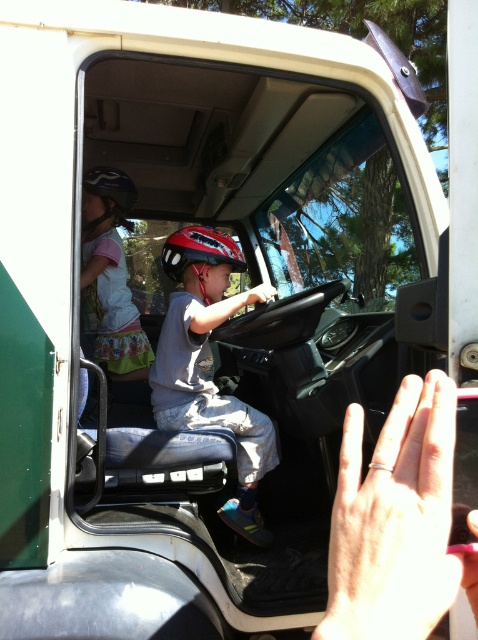
You are a safety inspector checking the tractor interior. The safety regulation states that the camera must be within 2 meters of the matte gray helmet at center to monitor the driver. Is the current placement compliant?

The matte gray helmet at center and camera are 1.85 meters apart, which is within the 2 meters requirement. The placement is compliant.

You are a safety inspector checking the tractor interior. You notice two helmets inside. Which helmet is closer to the front of the tractor, the matte black helmet at upper left or the matte red helmet at center?

The matte black helmet at upper left is closer to the front of the tractor because it is further to the viewer than the matte red helmet at center.

You are a child trying to choose a helmet to wear while riding in the tractor. The matte black helmet at upper left and the matte red helmet at center are available. Which helmet is smaller in width?

The matte black helmet at upper left is smaller in width than the matte red helmet at center.